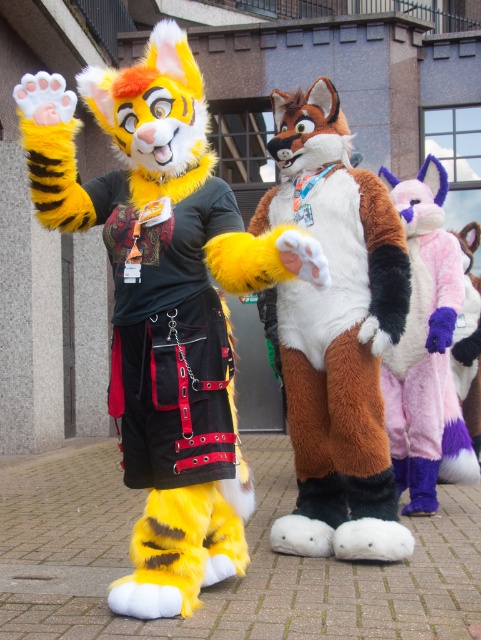
You are a photographer positioned to capture the two fursuiters in the scene. You notice the fluffy yellow fur at center and the fluffy fur skirt at center. Which object should you focus on first to ensure it appears sharp in the photo?

The fluffy yellow fur at center is in front of the fluffy fur skirt at center, so you should focus on the fluffy yellow fur at center first to ensure it appears sharp in the photo.

You are organizing a photoshoot and need to position the fluffy fur skirt at center and the purple fuzzy coat at right in a way that both are visible. Considering their widths, which object should be placed closer to the camera to ensure both are fully visible in the frame?

The purple fuzzy coat at right should be placed closer to the camera since it might be narrower than the fluffy fur skirt at center, allowing both to fit within the frame.

You are a photographer at a cosplay event and want to capture the fluffy fur skirt at center. Where should you focus your camera to ensure it is in the frame? Please provide coordinates in the format of a point like this example format point (169,337).

The point to focus on is point (169,337), which corresponds to the fluffy fur skirt at center.